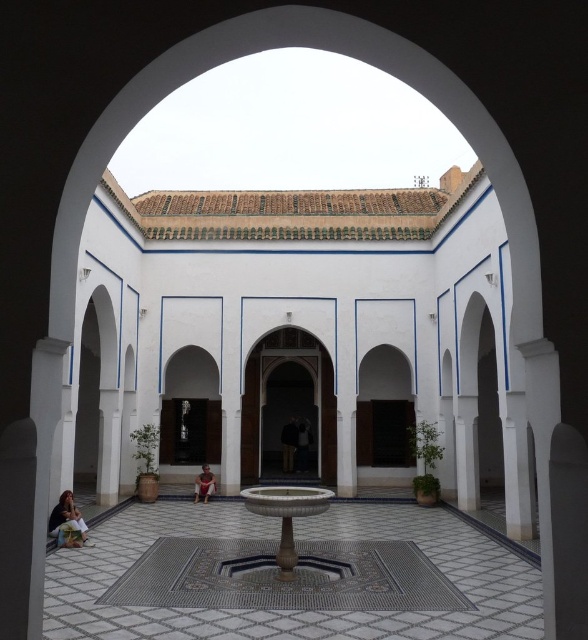
Question: Estimate the real-world distances between objects in this image. Which object is closer to the matte pink dress at lower left?

Choices:
 (A) brown leather jacket at center
 (B) marble fountain at center
 (C) matte white person at center
 (D) white mosaic fountain at center

Answer: (D)

Question: Is white mosaic fountain at center below brown leather jacket at center?

Choices:
 (A) no
 (B) yes

Answer: (A)

Question: Which object is farther from the camera taking this photo?

Choices:
 (A) brown leather jacket at center
 (B) white mosaic fountain at center
 (C) matte white person at center
 (D) marble fountain at center

Answer: (A)

Question: Is brown leather jacket at center in front of matte white person at center?

Choices:
 (A) no
 (B) yes

Answer: (A)

Question: Can you confirm if white mosaic fountain at center is positioned below marble fountain at center?

Choices:
 (A) yes
 (B) no

Answer: (A)

Question: Considering the real-world distances, which object is farthest from the matte pink dress at lower left?

Choices:
 (A) marble fountain at center
 (B) brown leather jacket at center
 (C) white mosaic fountain at center

Answer: (B)